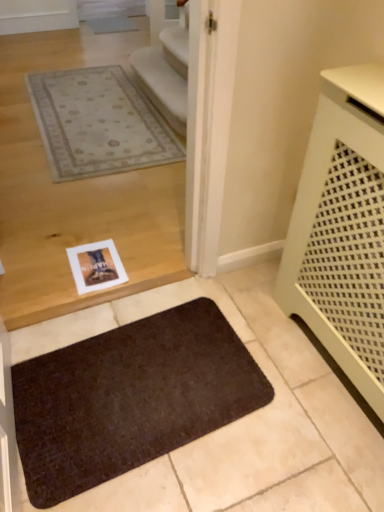
This screenshot has width=384, height=512. What do you see at coordinates (342, 229) in the screenshot?
I see `white perforated radiator at right` at bounding box center [342, 229].

The image size is (384, 512). I want to click on white perforated radiator at right, so [342, 229].

What is the approximate width of brown textured mat at lower center?

52.20 centimeters.

The height and width of the screenshot is (512, 384). What do you see at coordinates (129, 398) in the screenshot?
I see `brown textured mat at lower center` at bounding box center [129, 398].

The width and height of the screenshot is (384, 512). I want to click on brown textured mat at lower center, so click(x=129, y=398).

Locate an element on the screen. white perforated radiator at right is located at coordinates (342, 229).

Visually, is brown textured mat at lower center positioned to the left or to the right of white perforated radiator at right?

In the image, brown textured mat at lower center appears on the left side of white perforated radiator at right.

Consider the image. Between brown textured mat at lower center and white perforated radiator at right, which one is positioned in front?

Positioned in front is white perforated radiator at right.

Which point is more forward, (201, 385) or (373, 272)?

The point (373, 272) is in front.

From the image's perspective, is brown textured mat at lower center located above or below white perforated radiator at right?

Clearly, from the image's perspective, brown textured mat at lower center is below white perforated radiator at right.

From a real-world perspective, between brown textured mat at lower center and white perforated radiator at right, who is vertically higher?

white perforated radiator at right, from a real-world perspective.

Considering the sizes of objects brown textured mat at lower center and white perforated radiator at right in the image provided, who is thinner, brown textured mat at lower center or white perforated radiator at right?

With smaller width is white perforated radiator at right.

From the picture: Does brown textured mat at lower center have a greater height compared to white perforated radiator at right?

Incorrect, the height of brown textured mat at lower center is not larger of that of white perforated radiator at right.

Consider the image. Considering the relative sizes of brown textured mat at lower center and white perforated radiator at right in the image provided, is brown textured mat at lower center smaller than white perforated radiator at right?

Yes, brown textured mat at lower center is smaller than white perforated radiator at right.

Is brown textured mat at lower center not inside white perforated radiator at right?

Yes, brown textured mat at lower center is outside of white perforated radiator at right.

Is brown textured mat at lower center far from white perforated radiator at right?

brown textured mat at lower center is near white perforated radiator at right, not far away.

Based on the photo, is brown textured mat at lower center facing away from white perforated radiator at right?

brown textured mat at lower center is not turned away from white perforated radiator at right.

The width and height of the screenshot is (384, 512). In order to click on furniture above the brown textured mat at lower center (from the image's perspective) in this screenshot , I will do `click(342, 229)`.

Between white perforated radiator at right and brown textured mat at lower center, which one appears on the right side from the viewer's perspective?

From the viewer's perspective, white perforated radiator at right appears more on the right side.

Consider the image. Who is more distant, white perforated radiator at right or brown textured mat at lower center?

brown textured mat at lower center is further from the camera.

Based on the photo, which point is more distant from viewer, (363, 312) or (224, 395)?

The point (224, 395) is behind.

From the image's perspective, which object appears higher, white perforated radiator at right or brown textured mat at lower center?

white perforated radiator at right appears higher in the image.

From a real-world perspective, which object stands above the other?

white perforated radiator at right, from a real-world perspective.

Is white perforated radiator at right thinner than brown textured mat at lower center?

Correct, the width of white perforated radiator at right is less than that of brown textured mat at lower center.

Between white perforated radiator at right and brown textured mat at lower center, which one has less height?

Standing shorter between the two is brown textured mat at lower center.

Considering the relative sizes of white perforated radiator at right and brown textured mat at lower center in the image provided, is white perforated radiator at right bigger than brown textured mat at lower center?

Yes.

Is white perforated radiator at right inside or outside of brown textured mat at lower center?

white perforated radiator at right lies outside brown textured mat at lower center.

Does white perforated radiator at right touch brown textured mat at lower center?

There is a gap between white perforated radiator at right and brown textured mat at lower center.

Is white perforated radiator at right facing towards brown textured mat at lower center?

Yes.

Find the location of a particular element. The width and height of the screenshot is (384, 512). furniture in front of the brown textured mat at lower center is located at coordinates (342, 229).

You are a GUI agent. You are given a task and a screenshot of the screen. Output one action in this format:
    pyautogui.click(x=<x>, y=<y>)
    Task: Click on the furniture located on the right of brown textured mat at lower center
    This screenshot has height=512, width=384.
    Given the screenshot: What is the action you would take?
    pyautogui.click(x=342, y=229)

Where is `furniture that is above the brown textured mat at lower center (from a real-world perspective)`? This screenshot has height=512, width=384. furniture that is above the brown textured mat at lower center (from a real-world perspective) is located at coordinates (342, 229).